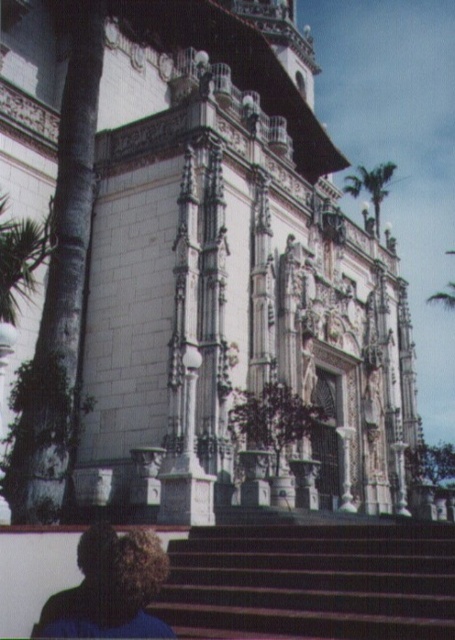
Question: Does dark curly hair at lower left appear under green leafy palm tree at upper right?

Choices:
 (A) no
 (B) yes

Answer: (B)

Question: Which point is closer to the camera?

Choices:
 (A) (259, 557)
 (B) (85, 621)
 (C) (344, 189)

Answer: (B)

Question: Which object is farther from the camera taking this photo?

Choices:
 (A) brown wooden stairs at lower center
 (B) dark curly hair at lower left
 (C) green leafy palm tree at upper right

Answer: (C)

Question: Does dark curly hair at lower left appear on the right side of green leafy palm tree at upper right?

Choices:
 (A) no
 (B) yes

Answer: (A)

Question: Can you confirm if brown wooden stairs at lower center is thinner than dark curly hair at lower left?

Choices:
 (A) yes
 (B) no

Answer: (B)

Question: Which point is closer to the camera?

Choices:
 (A) (247, 541)
 (B) (143, 588)

Answer: (B)